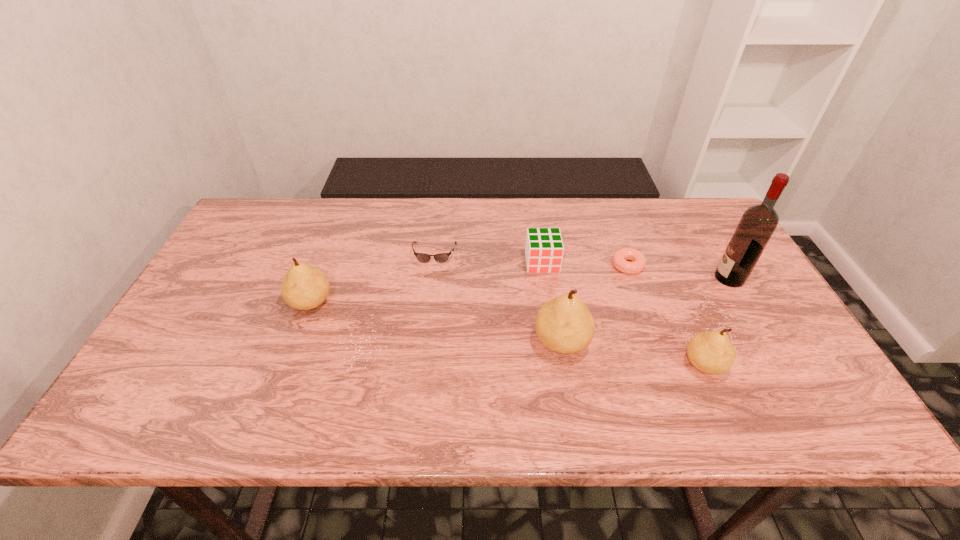
At what (x,y) coordinates should I click in order to perform the action: click on free space that is in between the second pear from right to left and the sixth object from right to left. Please return your answer as a coordinate pair (x, y). This screenshot has height=540, width=960. Looking at the image, I should click on (498, 298).

Locate an element on the screen. The image size is (960, 540). unoccupied position between the second tallest pear and the third shortest object is located at coordinates (426, 282).

This screenshot has width=960, height=540. I want to click on free space between the tallest object and the fifth object from left to right, so click(x=679, y=272).

Image resolution: width=960 pixels, height=540 pixels. I want to click on free space between the tallest object and the sixth object from right to left, so click(x=582, y=266).

Where is `free space between the shortest object and the second shortest pear`? free space between the shortest object and the second shortest pear is located at coordinates (469, 284).

At what (x,y) coordinates should I click in order to perform the action: click on unoccupied area between the sixth object from right to left and the second pear from left to right. Please return your answer as a coordinate pair (x, y). This screenshot has width=960, height=540. Looking at the image, I should click on 498,298.

You are a GUI agent. You are given a task and a screenshot of the screen. Output one action in this format:
    pyautogui.click(x=<x>, y=<y>)
    Task: Click on the free point between the second tallest pear and the second pear from left to right
    This screenshot has width=960, height=540.
    Given the screenshot: What is the action you would take?
    pyautogui.click(x=436, y=322)

Locate an element on the screen. free area in between the second object from left to right and the cube is located at coordinates (489, 259).

This screenshot has height=540, width=960. In order to click on object that stands as the second closest to the third object from right to left in this screenshot , I will do `click(758, 223)`.

Locate which object is the fifth closest to the rightmost pear. Please provide its 2D coordinates. Your answer should be formatted as a tuple, i.e. [(x, y)], where the tuple contains the x and y coordinates of a point satisfying the conditions above.

[(421, 257)]